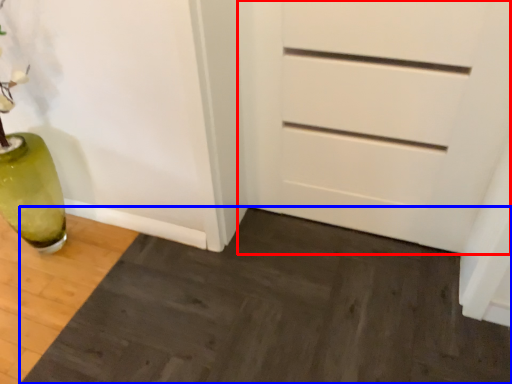
Question: Among these objects, which one is nearest to the camera, chest of drawers (highlighted by a red box) or doormat (highlighted by a blue box)?

Choices:
 (A) chest of drawers
 (B) doormat

Answer: (B)